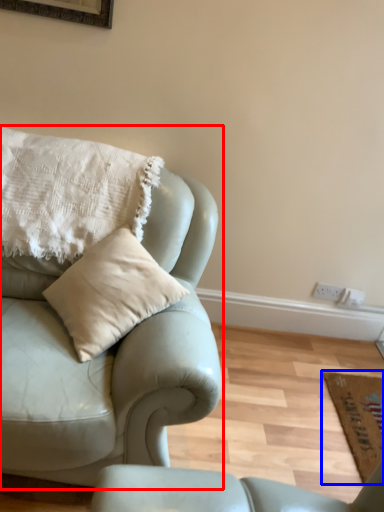
Question: Among these objects, which one is farthest to the camera, studio couch (highlighted by a red box) or mat (highlighted by a blue box)?

Choices:
 (A) studio couch
 (B) mat

Answer: (B)